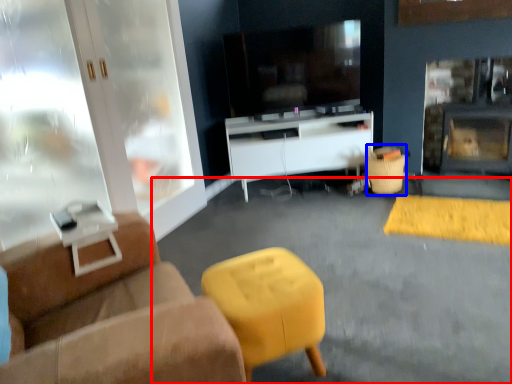
Question: Which object is closer to the camera taking this photo, concrete (highlighted by a red box) or bar stool (highlighted by a blue box)?

Choices:
 (A) concrete
 (B) bar stool

Answer: (A)